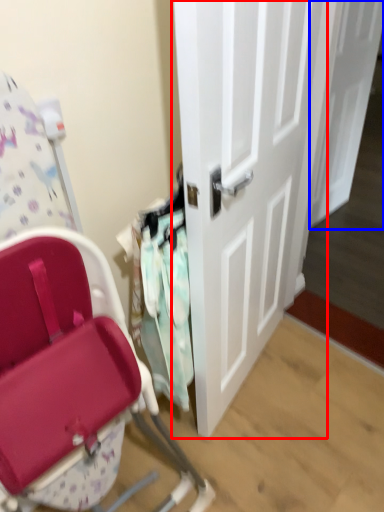
Question: Which object appears farthest to the camera in this image, door (highlighted by a red box) or door (highlighted by a blue box)?

Choices:
 (A) door
 (B) door

Answer: (B)